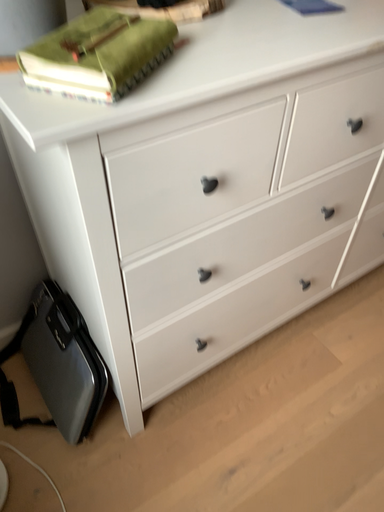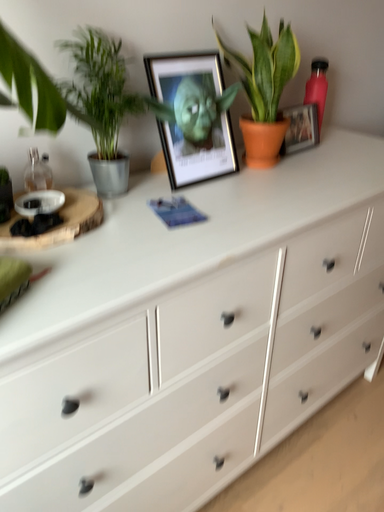
Question: How did the camera likely rotate when shooting the video?

Choices:
 (A) rotated downward
 (B) rotated upward

Answer: (B)